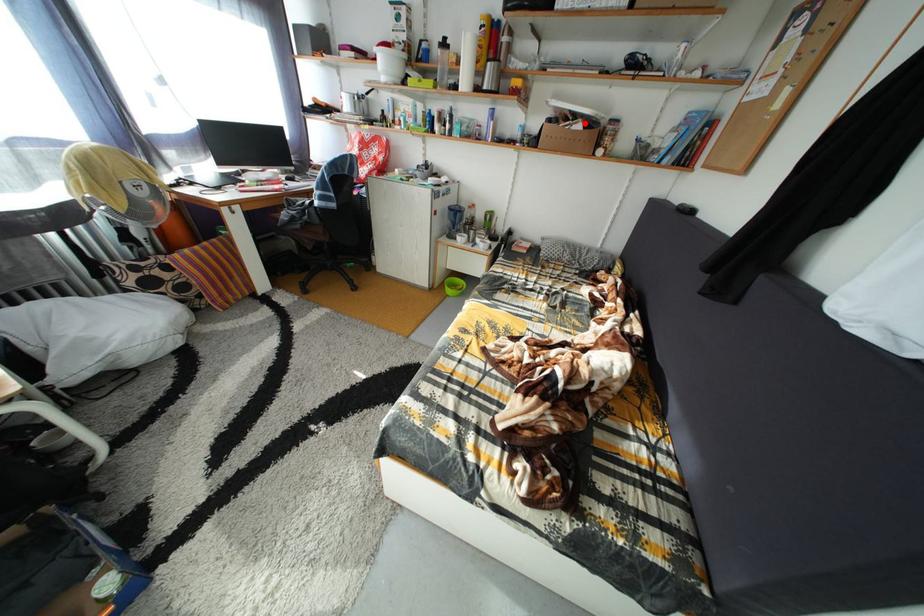
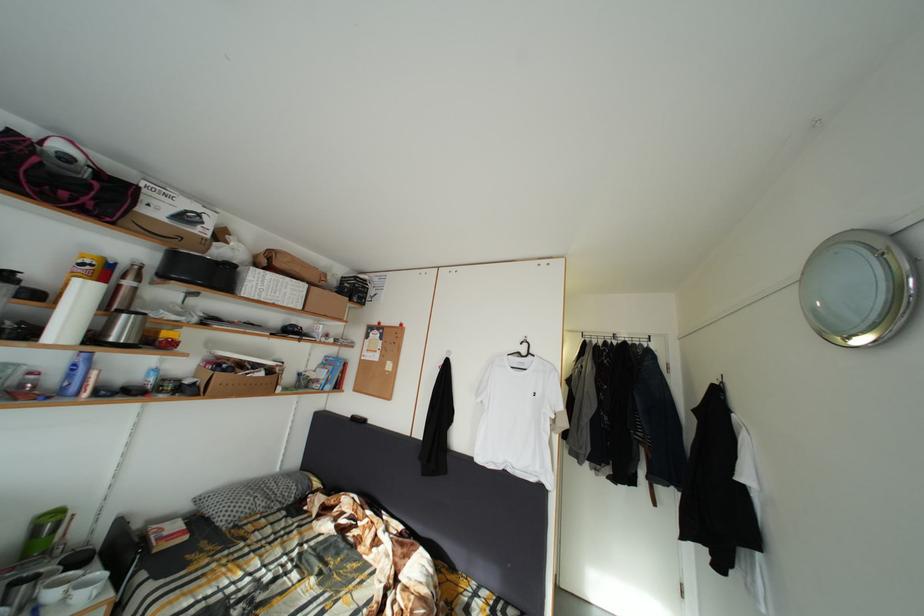
In the second image, find the point that corresponds to the highlighted location in the first image.

(264, 373)